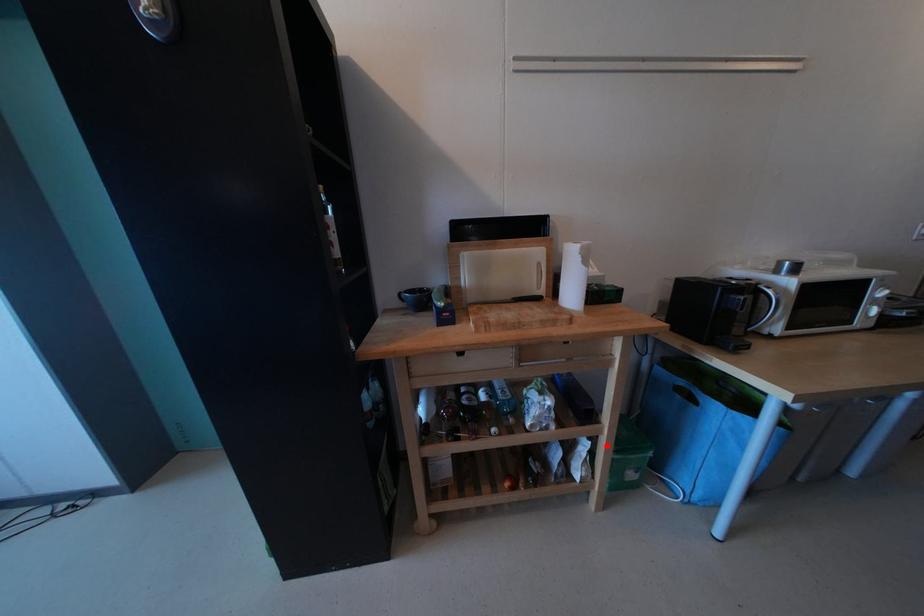
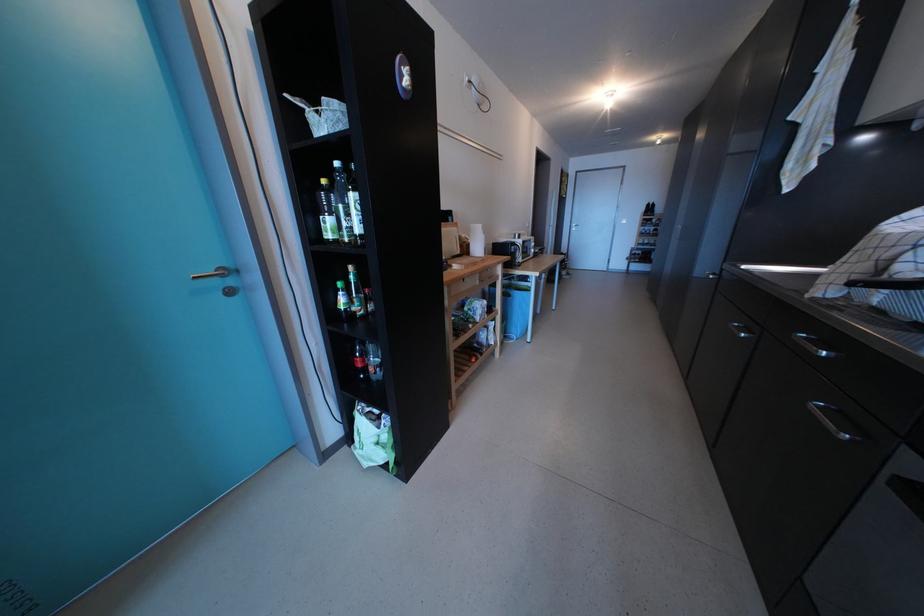
In the second image, find the point that corresponds to the highlighted location in the first image.

(507, 326)